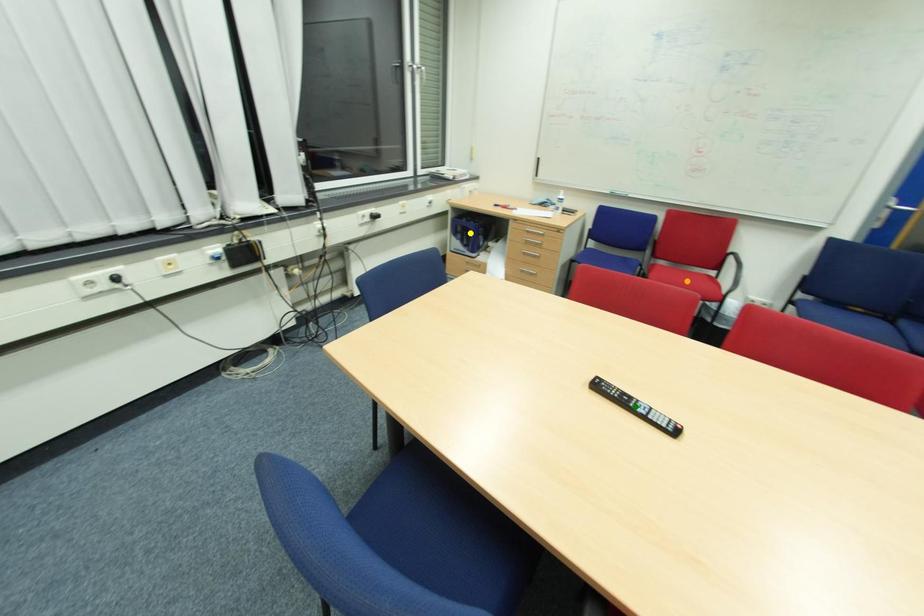
Order these from nearest to farthest:
orange point | yellow point | green point

green point < orange point < yellow point